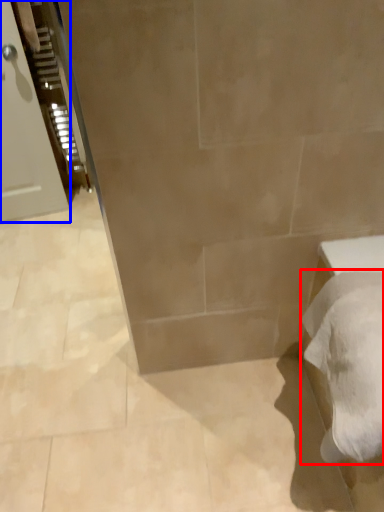
Question: Which object appears closest to the camera in this image, bath towel (highlighted by a red box) or door (highlighted by a blue box)?

Choices:
 (A) bath towel
 (B) door

Answer: (A)